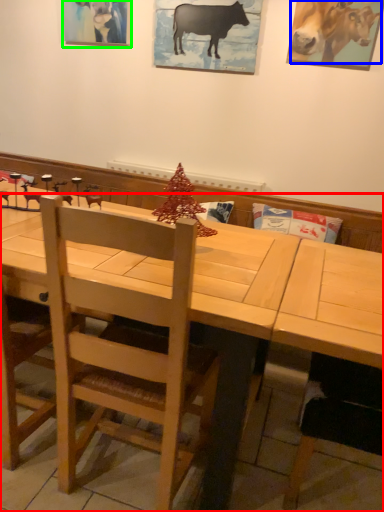
Question: Based on their relative distances, which object is farther from table (highlighted by a red box)? Choose from cattle (highlighted by a blue box) and picture frame (highlighted by a green box).

Choices:
 (A) cattle
 (B) picture frame

Answer: (B)